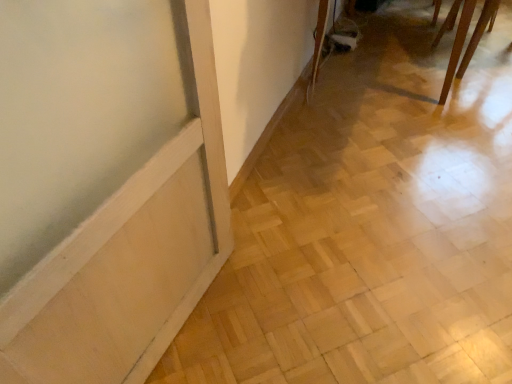
Find the location of a particular element. free region on the left part of wooden dining table at upper right is located at coordinates (405, 56).